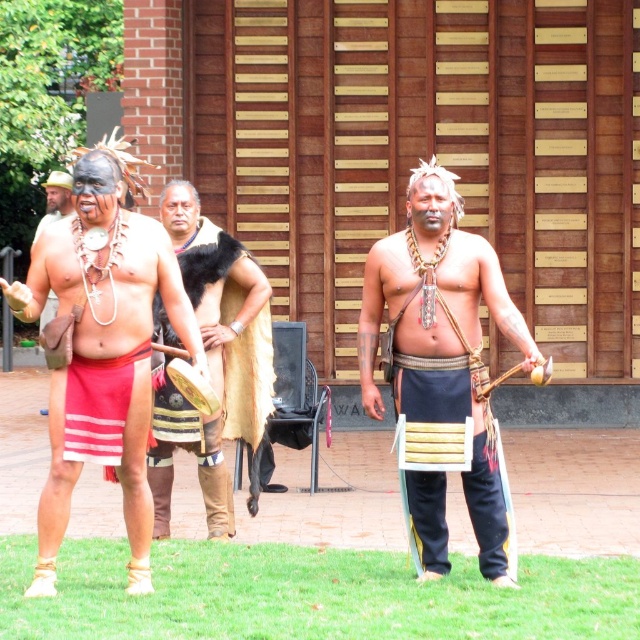
You are an anthropologist observing the scene. You notice the matte black loincloth at center and the wooden planks at center. Which object is higher in the image?

The matte black loincloth at center is taller than the wooden planks at center, so the matte black loincloth at center is higher in the image.

You are a photographer trying to capture a closeup of the matte black loincloth at center and the wooden planks at center in the scene. If your camera can focus on objects within a 4 inch range, will both items be in focus?

The distance between the matte black loincloth at center and the wooden planks at center is 4.34 inches. Since the camera can only focus within a 4 inch range, the two items are slightly beyond the focus range, so they might not both be in focus.